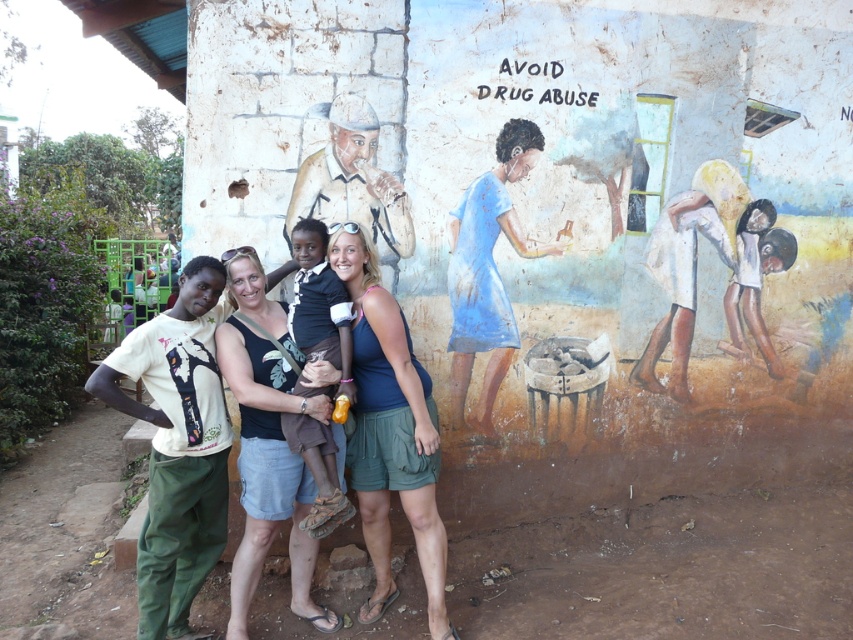
I want to click on matte black tank top at center, so click(267, 445).

Between matte black tank top at center and matte white dress at lower right, which one appears on the left side from the viewer's perspective?

From the viewer's perspective, matte black tank top at center appears more on the left side.

This screenshot has width=853, height=640. Find the location of `matte black tank top at center`. matte black tank top at center is located at coordinates (267, 445).

Who is taller, matte black tank top at center or blue matte dress at center?

Standing taller between the two is matte black tank top at center.

Does point (230, 612) come farther from viewer compared to point (461, 413)?

No, (230, 612) is closer to viewer.

Is point (271, 541) closer to viewer compared to point (451, 403)?

Yes, it is.

Identify the location of matte black tank top at center. (267, 445).

Which is more to the right, matte white dress at lower right or blue matte dress at center?

From the viewer's perspective, matte white dress at lower right appears more on the right side.

Can you confirm if matte white dress at lower right is bigger than blue matte dress at center?

Yes.

This screenshot has width=853, height=640. In order to click on matte white dress at lower right in this screenshot , I will do `click(695, 266)`.

Find the location of a particular element. This screenshot has height=640, width=853. matte white dress at lower right is located at coordinates (695, 266).